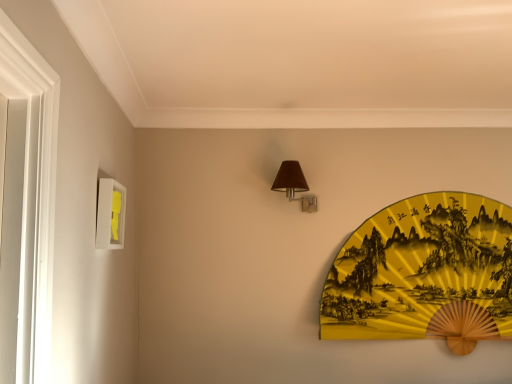
Question: Considering the relative sizes of yellow paper fan at upper right and white matte picture frame at left in the image provided, is yellow paper fan at upper right smaller than white matte picture frame at left?

Choices:
 (A) yes
 (B) no

Answer: (B)

Question: Is yellow paper fan at upper right oriented towards white matte picture frame at left?

Choices:
 (A) no
 (B) yes

Answer: (A)

Question: From a real-world perspective, is yellow paper fan at upper right under white matte picture frame at left?

Choices:
 (A) yes
 (B) no

Answer: (A)

Question: Is white matte picture frame at left completely or partially inside yellow paper fan at upper right?

Choices:
 (A) no
 (B) yes

Answer: (A)

Question: From the image's perspective, would you say yellow paper fan at upper right is positioned over white matte picture frame at left?

Choices:
 (A) no
 (B) yes

Answer: (A)

Question: From a real-world perspective, is yellow paper fan at upper right positioned above or below white matte picture frame at left?

Choices:
 (A) below
 (B) above

Answer: (A)

Question: Is yellow paper fan at upper right in front of or behind white matte picture frame at left in the image?

Choices:
 (A) front
 (B) behind

Answer: (B)

Question: Would you say yellow paper fan at upper right is inside or outside white matte picture frame at left?

Choices:
 (A) inside
 (B) outside

Answer: (B)

Question: Is yellow paper fan at upper right taller or shorter than white matte picture frame at left?

Choices:
 (A) tall
 (B) short

Answer: (A)

Question: In terms of width, does matte brown fabric at upper center look wider or thinner when compared to white matte picture frame at left?

Choices:
 (A) thin
 (B) wide

Answer: (B)

Question: Relative to white matte picture frame at left, is matte brown fabric at upper center in front or behind?

Choices:
 (A) behind
 (B) front

Answer: (A)

Question: From the image's perspective, is matte brown fabric at upper center above or below white matte picture frame at left?

Choices:
 (A) above
 (B) below

Answer: (A)

Question: In the image, is matte brown fabric at upper center on the left side or the right side of white matte picture frame at left?

Choices:
 (A) left
 (B) right

Answer: (B)

Question: Is white matte picture frame at left wider or thinner than yellow paper fan at upper right?

Choices:
 (A) thin
 (B) wide

Answer: (A)

Question: Considering their positions, is white matte picture frame at left located in front of or behind yellow paper fan at upper right?

Choices:
 (A) behind
 (B) front

Answer: (B)